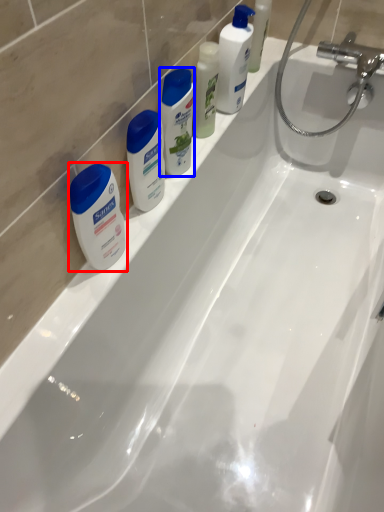
Question: Among these objects, which one is farthest to the camera, toiletry (highlighted by a red box) or cleaning product (highlighted by a blue box)?

Choices:
 (A) toiletry
 (B) cleaning product

Answer: (B)